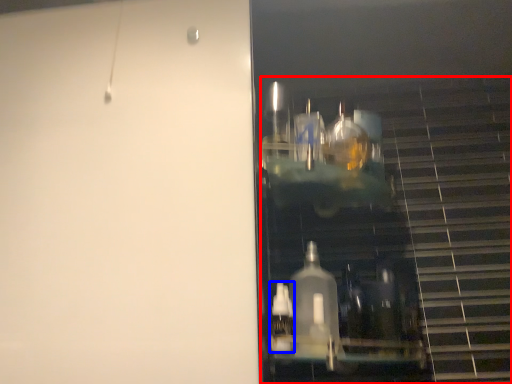
Question: Which point is closer to the camera, stairwell (highlighted by a red box) or bottle (highlighted by a blue box)?

Choices:
 (A) stairwell
 (B) bottle

Answer: (A)